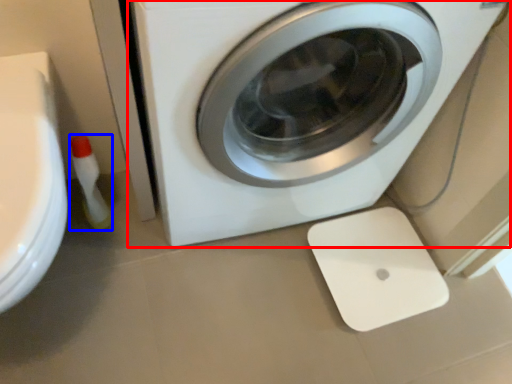
Question: Among these objects, which one is nearest to the camera, washing machine (highlighted by a red box) or cleaning product (highlighted by a blue box)?

Choices:
 (A) washing machine
 (B) cleaning product

Answer: (A)